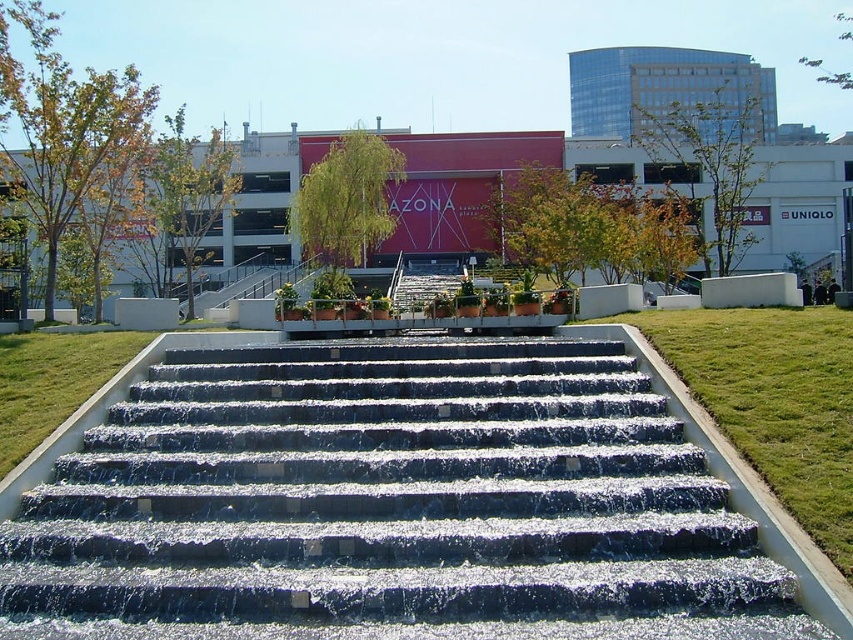
You are standing at the base of the cascading water steps in the urban landscape. You notice two points marked on the steps. The first point is at coordinate point [724,344] and the second is at point [486,324]. Which point is nearer to your current position?

Point [724,344] is closer to the camera than point [486,324], so the first point is nearer to your current position.

You are standing in front of the cascading water steps and want to reach the building with the red facade displaying AZONA. Which point, point [113,620] or point [526,326], is closer to you as you start your journey?

Point [113,620] is closer to the viewer than point [526,326], so you should head towards point [113,620] first.

You are a maintenance worker who needs to walk from the smooth stone steps at center to the green grass at lower right. How far will you have to walk?

The smooth stone steps at center and green grass at lower right are 7.71 meters apart from each other, so you will have to walk 7.71 meters to reach the green grass at lower right from the smooth stone steps at center.